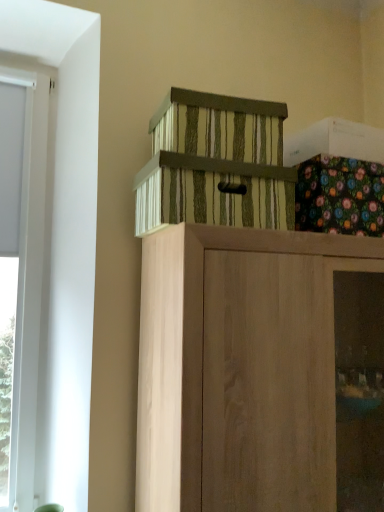
Question: From a real-world perspective, is striped cardboard box at upper center, arranged as the first cabinetry when viewed from the top, positioned under wooden cabinet at center, positioned as the 1th cabinetry in bottom-to-top order, based on gravity?

Choices:
 (A) yes
 (B) no

Answer: (B)

Question: Does striped cardboard box at upper center, arranged as the first cabinetry when viewed from the top, have a larger size compared to wooden cabinet at center, which ranks as the second cabinetry in top-to-bottom order?

Choices:
 (A) no
 (B) yes

Answer: (A)

Question: Does striped cardboard box at upper center, arranged as the first cabinetry when viewed from the top, have a greater width compared to wooden cabinet at center, which ranks as the second cabinetry in top-to-bottom order?

Choices:
 (A) yes
 (B) no

Answer: (B)

Question: Could wooden cabinet at center, which ranks as the second cabinetry in top-to-bottom order, be considered to be inside striped cardboard box at upper center, positioned as the 2th cabinetry in bottom-to-top order?

Choices:
 (A) yes
 (B) no

Answer: (B)

Question: From a real-world perspective, is striped cardboard box at upper center, arranged as the first cabinetry when viewed from the top, on top of wooden cabinet at center, which ranks as the second cabinetry in top-to-bottom order?

Choices:
 (A) yes
 (B) no

Answer: (A)

Question: Is striped cardboard box at upper center, arranged as the first cabinetry when viewed from the top, beside wooden cabinet at center, positioned as the 1th cabinetry in bottom-to-top order?

Choices:
 (A) no
 (B) yes

Answer: (A)

Question: Is wooden cabinet at center, positioned as the 1th cabinetry in bottom-to-top order, to the left of floral fabric box at upper right from the viewer's perspective?

Choices:
 (A) yes
 (B) no

Answer: (A)

Question: Is wooden cabinet at center, which ranks as the second cabinetry in top-to-bottom order, far away from floral fabric box at upper right?

Choices:
 (A) no
 (B) yes

Answer: (A)

Question: Is wooden cabinet at center, which ranks as the second cabinetry in top-to-bottom order, next to floral fabric box at upper right?

Choices:
 (A) yes
 (B) no

Answer: (B)

Question: Considering the relative sizes of wooden cabinet at center, positioned as the 1th cabinetry in bottom-to-top order, and floral fabric box at upper right in the image provided, is wooden cabinet at center, positioned as the 1th cabinetry in bottom-to-top order, thinner than floral fabric box at upper right?

Choices:
 (A) yes
 (B) no

Answer: (B)

Question: Considering the relative positions of wooden cabinet at center, positioned as the 1th cabinetry in bottom-to-top order, and floral fabric box at upper right in the image provided, is wooden cabinet at center, positioned as the 1th cabinetry in bottom-to-top order, to the right of floral fabric box at upper right from the viewer's perspective?

Choices:
 (A) no
 (B) yes

Answer: (A)

Question: Is wooden cabinet at center, positioned as the 1th cabinetry in bottom-to-top order, looking in the opposite direction of floral fabric box at upper right?

Choices:
 (A) no
 (B) yes

Answer: (A)

Question: Is wooden cabinet at center, positioned as the 1th cabinetry in bottom-to-top order, directly adjacent to striped cardboard box at upper center, positioned as the 2th cabinetry in bottom-to-top order?

Choices:
 (A) yes
 (B) no

Answer: (B)